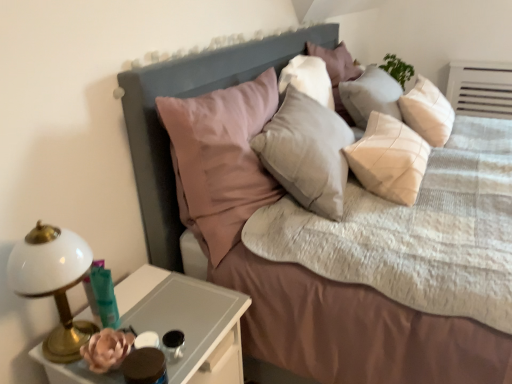
What do you see at coordinates (187, 320) in the screenshot? I see `white glossy nightstand at lower left` at bounding box center [187, 320].

In order to face translucent glass candle holder at lower left, the 2th candle holder when ordered from right to left, should I rotate leftwards or rightwards?

Turn left by 18.850 degrees to look at translucent glass candle holder at lower left, the 2th candle holder when ordered from right to left.

Find the location of a particular element. The image size is (512, 384). white glossy bedside lamp at left is located at coordinates (53, 283).

Image resolution: width=512 pixels, height=384 pixels. I want to click on textured beige bed at center, so coord(353,329).

Does translucent glass candle holder at lower left, the 2th candle holder when ordered from right to left, turn towards black glass candle holder at lower left, arranged as the second candle holder when viewed from the left?

Yes, translucent glass candle holder at lower left, the 2th candle holder when ordered from right to left, faces towards black glass candle holder at lower left, arranged as the second candle holder when viewed from the left.

Who is smaller, translucent glass candle holder at lower left, the 2th candle holder when ordered from right to left, or black glass candle holder at lower left, arranged as the 1th candle holder when viewed from the right?

black glass candle holder at lower left, arranged as the 1th candle holder when viewed from the right.

From the image's perspective, which one is positioned lower, translucent glass candle holder at lower left, positioned as the 1th candle holder in left-to-right order, or black glass candle holder at lower left, arranged as the second candle holder when viewed from the left?

From the image's view, black glass candle holder at lower left, arranged as the second candle holder when viewed from the left, is below.

Considering the relative positions of translucent glass candle holder at lower left, positioned as the 1th candle holder in left-to-right order, and black glass candle holder at lower left, arranged as the 1th candle holder when viewed from the right, in the image provided, is translucent glass candle holder at lower left, positioned as the 1th candle holder in left-to-right order, to the left of black glass candle holder at lower left, arranged as the 1th candle holder when viewed from the right, from the viewer's perspective?

Yes.

From the image's perspective, between textured beige bed at center and white glossy bedside lamp at left, who is located below?

From the image's view, white glossy bedside lamp at left is below.

Is textured beige bed at center positioned far away from white glossy bedside lamp at left?

That's not correct — textured beige bed at center is a little close to white glossy bedside lamp at left.

Can you tell me how much textured beige bed at center and white glossy bedside lamp at left differ in facing direction?

They differ by 1.64 degrees in their facing directions.

Based on the photo, is textured beige bed at center wider or thinner than white glossy bedside lamp at left?

Considering their sizes, textured beige bed at center looks broader than white glossy bedside lamp at left.

Which object is thinner, textured beige bed at center or white glossy nightstand at lower left?

white glossy nightstand at lower left is thinner.

Which object is positioned more to the right, textured beige bed at center or white glossy nightstand at lower left?

textured beige bed at center.

Is textured beige bed at center aimed at white glossy nightstand at lower left?

No, textured beige bed at center is not aimed at white glossy nightstand at lower left.

From a real-world perspective, is matte gray headboard at upper center below white glossy bedside lamp at left?

No.

Considering the points (178, 255) and (50, 270), which point is behind, point (178, 255) or point (50, 270)?

Point (178, 255)

Considering the relative sizes of matte gray headboard at upper center and white glossy bedside lamp at left in the image provided, is matte gray headboard at upper center shorter than white glossy bedside lamp at left?

Incorrect, the height of matte gray headboard at upper center does not fall short of that of white glossy bedside lamp at left.

Is translucent glass candle holder at lower left, positioned as the 1th candle holder in left-to-right order, at the left side of textured beige bed at center?

Yes.

Is translucent glass candle holder at lower left, the 2th candle holder when ordered from right to left, further to the viewer compared to textured beige bed at center?

Yes, translucent glass candle holder at lower left, the 2th candle holder when ordered from right to left, is further from the camera.

The width and height of the screenshot is (512, 384). In order to click on candle holder that is the 2nd one when counting leftward from the textured beige bed at center in this screenshot , I will do `click(102, 295)`.

In the scene shown: How different are the orientations of translucent glass candle holder at lower left, the 2th candle holder when ordered from right to left, and white glossy nightstand at lower left in degrees?

1.29 degrees.

Between translucent glass candle holder at lower left, the 2th candle holder when ordered from right to left, and white glossy nightstand at lower left, which one has smaller size?

Smaller between the two is translucent glass candle holder at lower left, the 2th candle holder when ordered from right to left.

Between translucent glass candle holder at lower left, the 2th candle holder when ordered from right to left, and white glossy nightstand at lower left, which one appears on the left side from the viewer's perspective?

Positioned to the left is translucent glass candle holder at lower left, the 2th candle holder when ordered from right to left.

Which object is more forward, translucent glass candle holder at lower left, the 2th candle holder when ordered from right to left, or matte gray headboard at upper center?

translucent glass candle holder at lower left, the 2th candle holder when ordered from right to left, is more forward.

You are a GUI agent. You are given a task and a screenshot of the screen. Output one action in this format:
    pyautogui.click(x=<x>, y=<y>)
    Task: Click on the headboard above the translucent glass candle holder at lower left, the 2th candle holder when ordered from right to left (from a real-world perspective)
    The height and width of the screenshot is (384, 512).
    Given the screenshot: What is the action you would take?
    pyautogui.click(x=188, y=97)

Which of these two, translucent glass candle holder at lower left, the 2th candle holder when ordered from right to left, or matte gray headboard at upper center, stands shorter?

translucent glass candle holder at lower left, the 2th candle holder when ordered from right to left.

Locate an element on the screen. This screenshot has width=512, height=384. candle holder located above the black glass candle holder at lower left, arranged as the 1th candle holder when viewed from the right (from a real-world perspective) is located at coordinates (102, 295).

Image resolution: width=512 pixels, height=384 pixels. What are the coordinates of `bed that appears below the white glossy bedside lamp at left (from a real-world perspective)` in the screenshot? It's located at (353, 329).

From the image, which object appears to be nearer to black glass candle holder at lower left, arranged as the second candle holder when viewed from the left, matte gray headboard at upper center or textured beige bed at center?

Based on the image, textured beige bed at center appears to be nearer to black glass candle holder at lower left, arranged as the second candle holder when viewed from the left.

When comparing their distances from black glass candle holder at lower left, arranged as the second candle holder when viewed from the left, does white glossy bedside lamp at left or translucent glass candle holder at lower left, positioned as the 1th candle holder in left-to-right order, seem further?

white glossy bedside lamp at left is further to black glass candle holder at lower left, arranged as the second candle holder when viewed from the left.

When comparing their distances from matte gray headboard at upper center, does white glossy bedside lamp at left or black glass candle holder at lower left, arranged as the 1th candle holder when viewed from the right, seem further?

Among the two, black glass candle holder at lower left, arranged as the 1th candle holder when viewed from the right, is located further to matte gray headboard at upper center.

From the image, which object appears to be farther from textured beige bed at center, white glossy nightstand at lower left or matte gray headboard at upper center?

Based on the image, white glossy nightstand at lower left appears to be further to textured beige bed at center.

Which object lies nearer to the anchor point black glass candle holder at lower left, arranged as the 1th candle holder when viewed from the right, white glossy nightstand at lower left or translucent glass candle holder at lower left, the 2th candle holder when ordered from right to left?

white glossy nightstand at lower left is closer to black glass candle holder at lower left, arranged as the 1th candle holder when viewed from the right.

When comparing their distances from white glossy bedside lamp at left, does matte gray headboard at upper center or translucent glass candle holder at lower left, the 2th candle holder when ordered from right to left, seem further?

The object further to white glossy bedside lamp at left is matte gray headboard at upper center.

Considering their positions, is matte gray headboard at upper center positioned further to textured beige bed at center than white glossy bedside lamp at left?

white glossy bedside lamp at left is positioned further to the anchor textured beige bed at center.

Estimate the real-world distances between objects in this image. Which object is closer to textured beige bed at center, translucent glass candle holder at lower left, positioned as the 1th candle holder in left-to-right order, or black glass candle holder at lower left, arranged as the second candle holder when viewed from the left?

Among the two, translucent glass candle holder at lower left, positioned as the 1th candle holder in left-to-right order, is located nearer to textured beige bed at center.

The height and width of the screenshot is (384, 512). I want to click on candle holder between translucent glass candle holder at lower left, positioned as the 1th candle holder in left-to-right order, and textured beige bed at center, in the horizontal direction, so click(x=173, y=345).

Locate an element on the screen. Image resolution: width=512 pixels, height=384 pixels. nightstand between translucent glass candle holder at lower left, positioned as the 1th candle holder in left-to-right order, and textured beige bed at center, in the horizontal direction is located at coordinates (187, 320).

Locate an element on the screen. This screenshot has width=512, height=384. candle holder between white glossy nightstand at lower left and textured beige bed at center is located at coordinates (173, 345).

Locate an element on the screen. headboard located between white glossy nightstand at lower left and textured beige bed at center in the left-right direction is located at coordinates (188, 97).